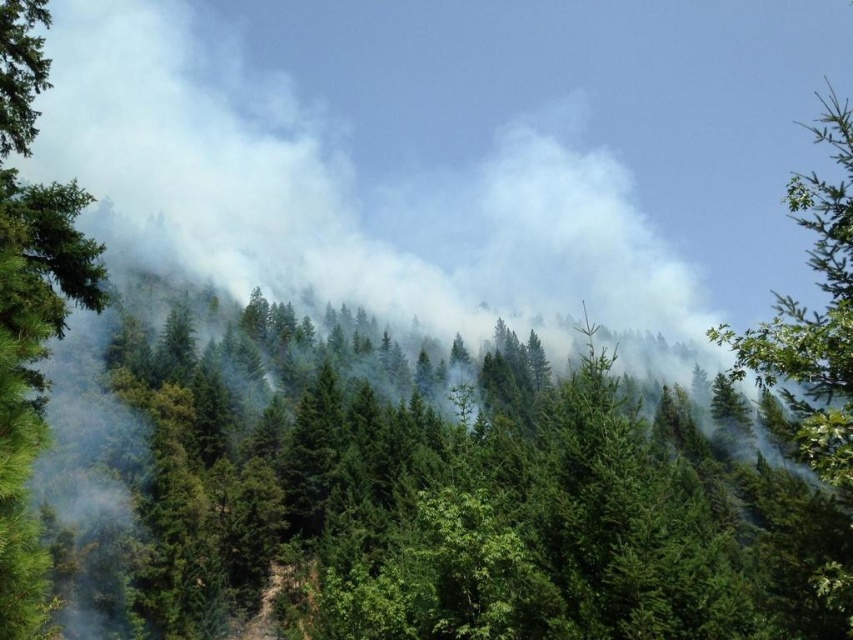
Based on the photo, you are a firefighter assessing the forest fire situation. You notice the green matte tree at left and the green leafy tree at upper right. Which tree has a larger width according to the description?

The green matte tree at left might be wider than the green leafy tree at upper right, so the green matte tree at left has a larger width according to the description.